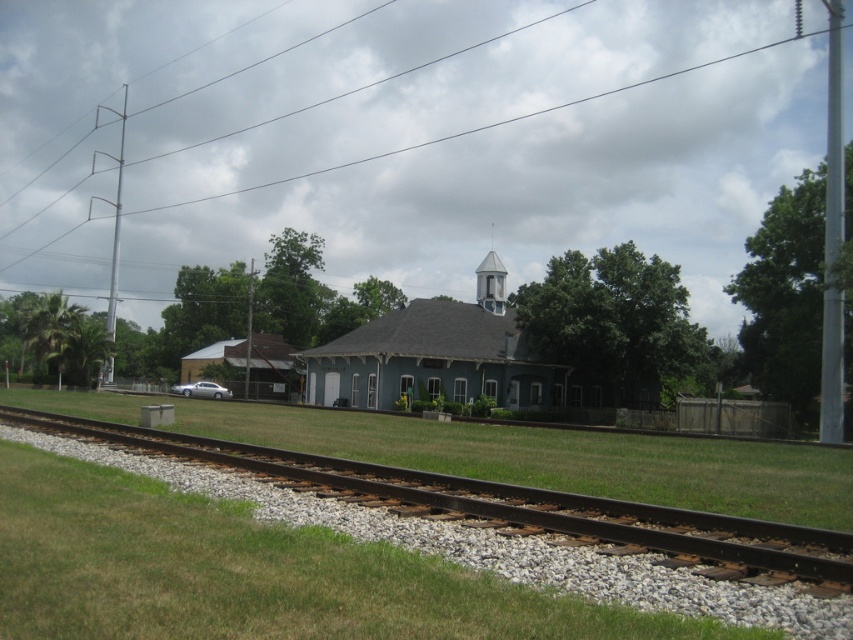
Looking at this image, you are a landscape architect designing a pathway that needs to be at least 3 meters wide to accommodate a wheelchair ramp. You observe the brown gravel track at lower left and the white painted wood bell tower at upper center in the image. Which of these two features has a width that meets or exceeds the required 3 meters?

The brown gravel track at lower left might be wider than white painted wood bell tower at upper center, so it is possible that the gravel track meets the required width of 3 meters. The bell tower, however, is likely narrower and may not suffice.

You are a visitor standing in front of the light blue wood church at center and the white painted wood bell tower at upper center. Which structure is closer to you?

The light blue wood church at center is closer to you because it is in front of the white painted wood bell tower at upper center.

You are standing at the point marked as point [514,506] in the image. What type of surface are you currently standing on?

The point [514,506] is on brown gravel track at lower left, so you are standing on a brown gravel track.